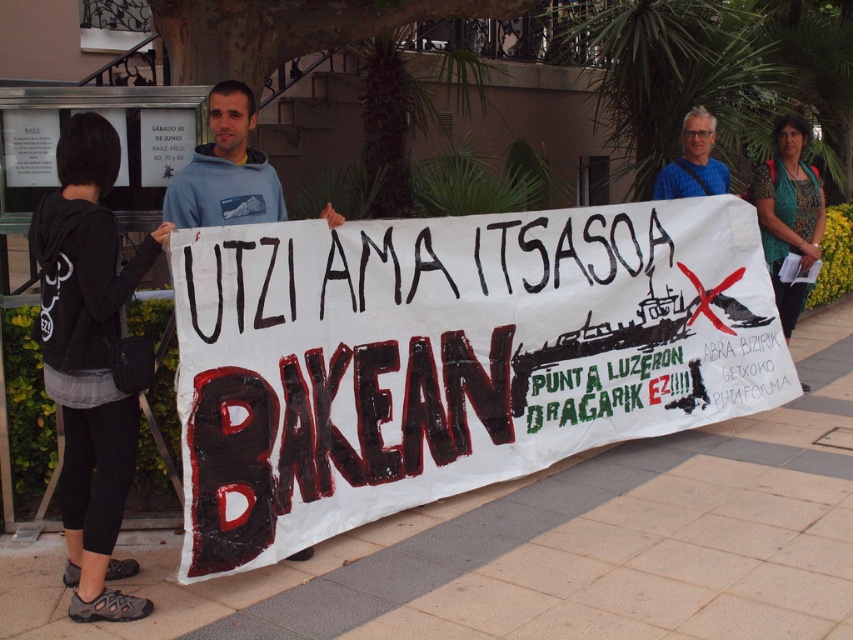
You are a photographer standing at the camera position. You want to take a photo focusing on the protest banner. Which of the two points, point (309, 486) or point (233, 221), is closer to your camera position?

Point (309, 486) is closer to the camera than point (233, 221).

You are a photographer trying to capture the protest banner clearly. You notice two items in the frame that might distract from the banner. These items are the teal printed blouse at upper right and the blue fabric at upper center. Which of these two items is wider and might block the banner more if not adjusted?

The teal printed blouse at upper right is wider than the blue fabric at upper center, so it might block the banner more if not adjusted.